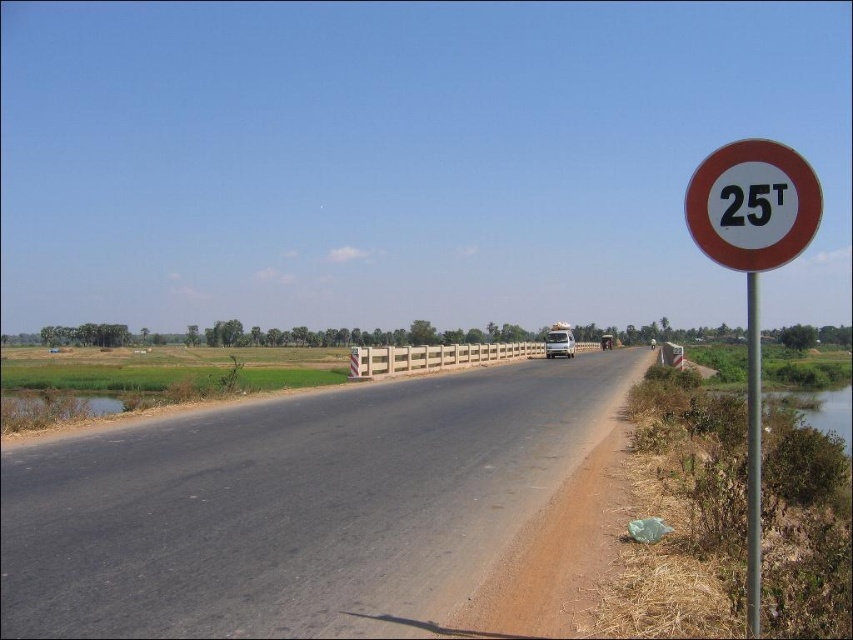
Consider the image. You are driving a truck that needs to pass through the road shown in the image. You see a white plastic sign at right and a white plastic pole at right. Which object is bigger in size?

The white plastic sign at right is larger in size compared to the white plastic pole at right.

You are driving a truck and see the white plastic sign at right and the white circular sign at right on the roadside. Which one is wider?

The white plastic sign at right is wider than the white circular sign at right.